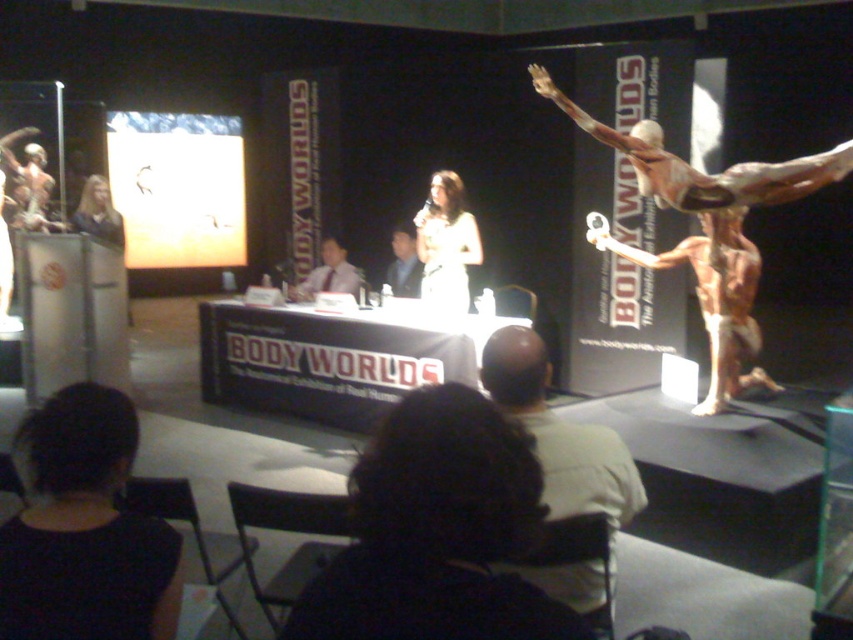
Between point (312, 273) and point (415, 276), which one is positioned behind?

Point (312, 273)

Which is more to the left, matte white shirt at center or smooth gray suit at center?

From the viewer's perspective, matte white shirt at center appears more on the left side.

Between point (321, 282) and point (410, 276), which one is positioned behind?

Point (410, 276)

Locate an element on the screen. Image resolution: width=853 pixels, height=640 pixels. matte white shirt at center is located at coordinates (329, 273).

Is the position of black fabric hair at lower left more distant than that of matte white shirt at center?

No.

Is black fabric hair at lower left bigger than matte white shirt at center?

Actually, black fabric hair at lower left might be smaller than matte white shirt at center.

Is point (53, 483) positioned behind point (339, 253)?

That is False.

Find the location of a particular element. Image resolution: width=853 pixels, height=640 pixels. black fabric hair at lower left is located at coordinates (84, 529).

Is white silk dress at center thinner than smooth gray suit at center?

Incorrect, white silk dress at center's width is not less than smooth gray suit at center's.

Find the location of a particular element. white silk dress at center is located at coordinates (445, 244).

I want to click on white silk dress at center, so click(x=445, y=244).